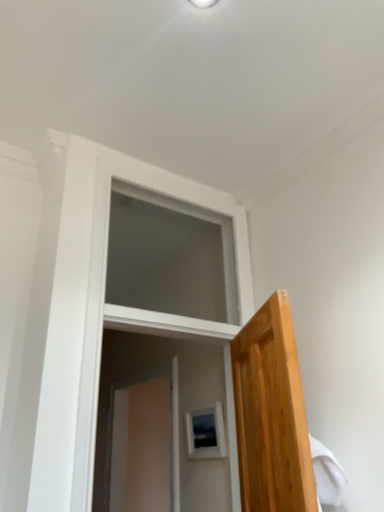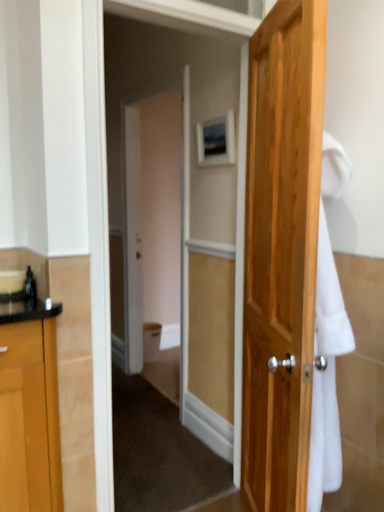
Question: How did the camera likely rotate when shooting the video?

Choices:
 (A) rotated upward
 (B) rotated downward

Answer: (B)